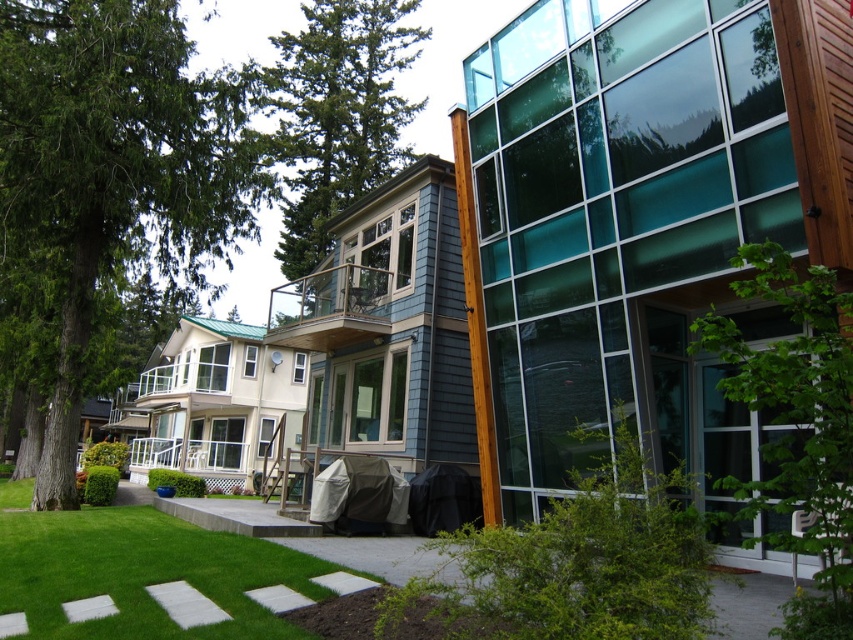
Question: Which point is closer to the camera taking this photo?

Choices:
 (A) coord(701,564)
 (B) coord(219,589)
 (C) coord(196,90)

Answer: (A)

Question: Is green textured tree at left wider than green grass at lower left?

Choices:
 (A) yes
 (B) no

Answer: (B)

Question: Is green textured tree at left positioned at the back of green leafy bush at lower center?

Choices:
 (A) yes
 (B) no

Answer: (A)

Question: Which point is closer to the camera?

Choices:
 (A) green grass at lower left
 (B) green leafy tree at center

Answer: (B)

Question: Does green textured tree at left come behind green textured tree at upper center?

Choices:
 (A) yes
 (B) no

Answer: (B)

Question: Which of the following is the closest to the observer?

Choices:
 (A) (334, 38)
 (B) (668, 515)
 (C) (93, 538)

Answer: (B)